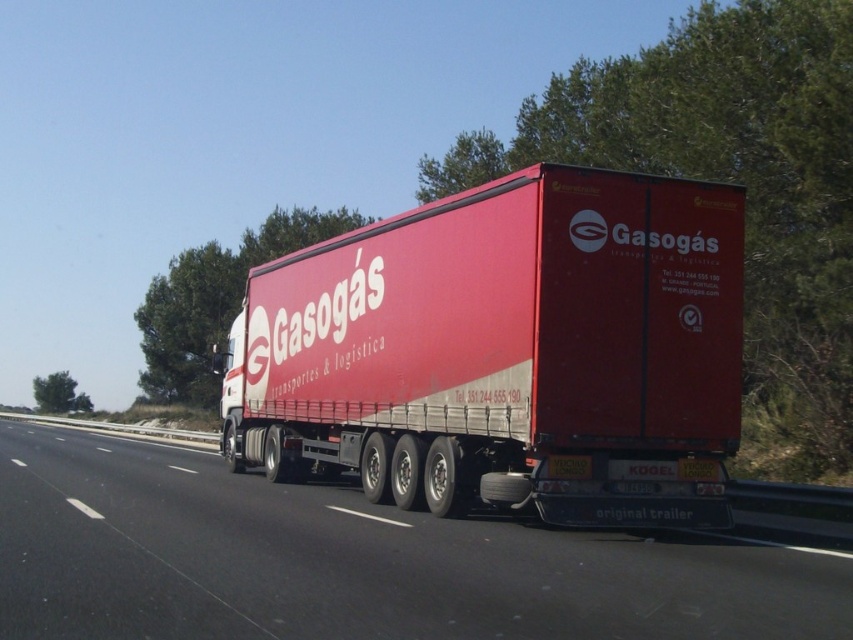
Question: Is matte red trailer truck at center positioned at the back of metallic trailer at center?

Choices:
 (A) no
 (B) yes

Answer: (B)

Question: Can you confirm if matte red trailer truck at center is positioned above metallic trailer at center?

Choices:
 (A) no
 (B) yes

Answer: (B)

Question: Which of the following is the farthest from the observer?

Choices:
 (A) (442, 204)
 (B) (10, 426)

Answer: (B)

Question: Does matte red trailer truck at center have a smaller size compared to metallic trailer at center?

Choices:
 (A) no
 (B) yes

Answer: (A)